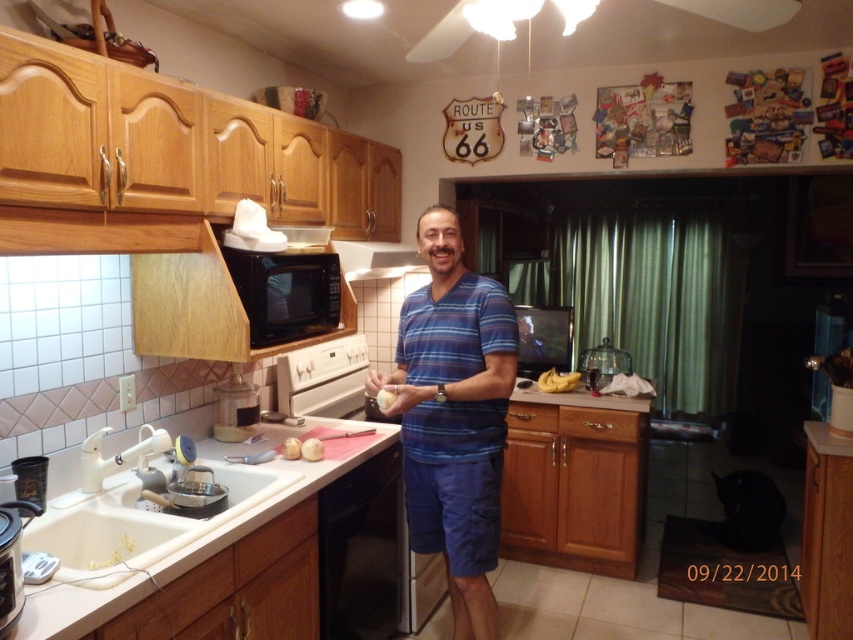
Question: Can you confirm if blue striped shirt at center is thinner than wooden exhaust hood at upper center?

Choices:
 (A) yes
 (B) no

Answer: (A)

Question: Which of the following is the closest to the observer?

Choices:
 (A) wooden exhaust hood at upper center
 (B) white glossy sink at lower left
 (C) black plastic dishwasher at lower left
 (D) blue striped shirt at center

Answer: (B)

Question: Which object appears closest to the camera in this image?

Choices:
 (A) black matte exhaust hood at upper center
 (B) yellow matte bananas at center

Answer: (A)

Question: Can you confirm if black matte microwave at upper center is thinner than transparent glass blender at right?

Choices:
 (A) no
 (B) yes

Answer: (B)

Question: Is white glossy countertop at lower left to the left of transparent glass blender at right from the viewer's perspective?

Choices:
 (A) yes
 (B) no

Answer: (A)

Question: Estimate the real-world distances between objects in this image. Which object is closer to the white glossy countertop at lower left?

Choices:
 (A) black stainless steel oven at center
 (B) white matte bread at lower center
 (C) black plastic dishwasher at lower left

Answer: (C)